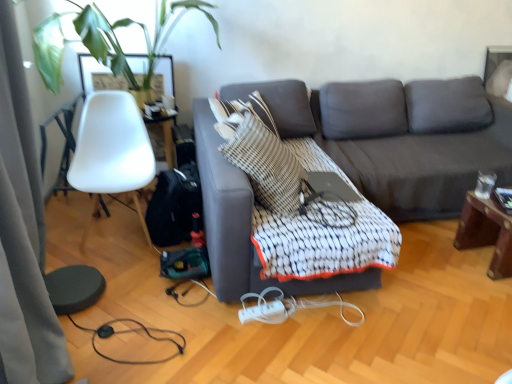
What do you see at coordinates (112, 149) in the screenshot?
I see `white matte chair at left` at bounding box center [112, 149].

What is the approximate width of white matte chair at left?

white matte chair at left is 21.68 inches in width.

Where is `white plastic extension cord at lower center`? white plastic extension cord at lower center is located at coordinates (264, 312).

Measure the distance between point (x=77, y=23) and camera.

A distance of 2.38 meters exists between point (x=77, y=23) and camera.

Where is `striped fabric throw pillow at center`? The image size is (512, 384). striped fabric throw pillow at center is located at coordinates (265, 163).

Describe the element at coordinates (288, 307) in the screenshot. This screenshot has height=384, width=512. I see `white plastic cable at lower center, which is counted as the second cable, starting from the left` at that location.

Where is `mahogany wood side table at right`? Image resolution: width=512 pixels, height=384 pixels. mahogany wood side table at right is located at coordinates (487, 232).

Locate an element on the screen. The height and width of the screenshot is (384, 512). white matte chair at left is located at coordinates (112, 149).

Is silky gray curtain at left positioned with its back to white textured quilt at center?

That's not correct — silky gray curtain at left is not looking away from white textured quilt at center.

I want to click on curtain above the white textured quilt at center (from the image's perspective), so click(x=23, y=232).

Does silky gray curtain at left appear on the left side of white textured quilt at center?

Indeed, silky gray curtain at left is positioned on the left side of white textured quilt at center.

Is dark gray fabric couch at center turned away from silky gray curtain at left?

No, silky gray curtain at left is not at the back of dark gray fabric couch at center.

Are dark gray fabric couch at center and silky gray curtain at left making contact?

No, dark gray fabric couch at center is not next to silky gray curtain at left.

Considering the sizes of objects dark gray fabric couch at center and silky gray curtain at left in the image provided, who is thinner, dark gray fabric couch at center or silky gray curtain at left?

silky gray curtain at left.

From the image's perspective, between silky gray curtain at left and striped fabric throw pillow at center, which one is located above?

From the image's view, striped fabric throw pillow at center is above.

Is silky gray curtain at left placed right next to striped fabric throw pillow at center?

There is a gap between silky gray curtain at left and striped fabric throw pillow at center.

Can you confirm if silky gray curtain at left is shorter than striped fabric throw pillow at center?

In fact, silky gray curtain at left may be taller than striped fabric throw pillow at center.

Is striped fabric throw pillow at center wider or thinner than black rubber cable at lower left, which appears as the 1th cable when viewed from the left?

In the image, striped fabric throw pillow at center appears to be more narrow than black rubber cable at lower left, which appears as the 1th cable when viewed from the left.

From their relative heights in the image, would you say striped fabric throw pillow at center is taller or shorter than black rubber cable at lower left, which appears as the 1th cable when viewed from the left?

Clearly, striped fabric throw pillow at center is taller compared to black rubber cable at lower left, which appears as the 1th cable when viewed from the left.

Do you think striped fabric throw pillow at center is within black rubber cable at lower left, which appears as the 1th cable when viewed from the left, or outside of it?

striped fabric throw pillow at center is not enclosed by black rubber cable at lower left, which appears as the 1th cable when viewed from the left.

From the image's perspective, is striped fabric throw pillow at center beneath black rubber cable at lower left, the 2th cable positioned from the right?

No, from the image's perspective, striped fabric throw pillow at center is not below black rubber cable at lower left, the 2th cable positioned from the right.

From a real-world perspective, is green leafy plant at upper left on silky gray curtain at left?

Yes, from a real-world perspective, green leafy plant at upper left is above silky gray curtain at left.

Is green leafy plant at upper left at the left side of silky gray curtain at left?

No, green leafy plant at upper left is not to the left of silky gray curtain at left.

In the scene shown: From the image's perspective, is green leafy plant at upper left positioned above or below silky gray curtain at left?

Based on their image positions, green leafy plant at upper left is located above silky gray curtain at left.

Is white plastic cable at lower center, positioned as the first cable in right-to-left order, inside the boundaries of black rubber cable at lower left, which appears as the 1th cable when viewed from the left, or outside?

The correct answer is: outside.

Which is more to the left, white plastic cable at lower center, which is counted as the second cable, starting from the left, or black rubber cable at lower left, which appears as the 1th cable when viewed from the left?

From the viewer's perspective, black rubber cable at lower left, which appears as the 1th cable when viewed from the left, appears more on the left side.

How distant is white plastic cable at lower center, which is counted as the second cable, starting from the left, from black rubber cable at lower left, which appears as the 1th cable when viewed from the left?

They are 19.93 inches apart.

At what (x,y) coordinates should I click in order to perform the action: click on cable that appears above the black rubber cable at lower left, the 2th cable positioned from the right (from the image's perspective). Please return your answer as a coordinate pair (x, y). Looking at the image, I should click on (288, 307).

Does black rubber cable at lower left, the 2th cable positioned from the right, have a lesser width compared to white textured quilt at center?

Correct, the width of black rubber cable at lower left, the 2th cable positioned from the right, is less than that of white textured quilt at center.

Locate an element on the screen. cable lying on the left of white textured quilt at center is located at coordinates (129, 332).

Is black rubber cable at lower left, which appears as the 1th cable when viewed from the left, oriented away from white textured quilt at center?

No, black rubber cable at lower left, which appears as the 1th cable when viewed from the left,'s orientation is not away from white textured quilt at center.

From the image's perspective, would you say black rubber cable at lower left, the 2th cable positioned from the right, is positioned over white textured quilt at center?

Incorrect, from the image's perspective, black rubber cable at lower left, the 2th cable positioned from the right, is lower than white textured quilt at center.

I want to click on quilt that appears on the right of silky gray curtain at left, so click(x=322, y=233).

This screenshot has width=512, height=384. I want to click on studio couch behind the silky gray curtain at left, so click(395, 140).

Considering their positions, is white plastic cable at lower center, which is counted as the second cable, starting from the left, positioned further to mahogany wood side table at right than black rubber cable at lower left, which appears as the 1th cable when viewed from the left?

Based on the image, black rubber cable at lower left, which appears as the 1th cable when viewed from the left, appears to be further to mahogany wood side table at right.

Based on their spatial positions, is white matte chair at left or mahogany wood side table at right closer to silky gray curtain at left?

white matte chair at left lies closer to silky gray curtain at left than the other object.

Which object lies further to the anchor point green leafy plant at upper left, black rubber cable at lower left, the 2th cable positioned from the right, or silky gray curtain at left?

Based on the image, black rubber cable at lower left, the 2th cable positioned from the right, appears to be further to green leafy plant at upper left.

Looking at the image, which one is located further to white plastic cable at lower center, which is counted as the second cable, starting from the left, mahogany wood side table at right or white textured quilt at center?

mahogany wood side table at right.

Which object lies nearer to the anchor point striped fabric throw pillow at center, white textured quilt at center or dark gray fabric couch at center?

Based on the image, white textured quilt at center appears to be nearer to striped fabric throw pillow at center.

Estimate the real-world distances between objects in this image. Which object is further from white textured quilt at center, black rubber cable at lower left, which appears as the 1th cable when viewed from the left, or striped fabric throw pillow at center?

black rubber cable at lower left, which appears as the 1th cable when viewed from the left, is further to white textured quilt at center.

Looking at the image, which one is located further to green leafy plant at upper left, white plastic cable at lower center, which is counted as the second cable, starting from the left, or dark gray fabric couch at center?

The object further to green leafy plant at upper left is white plastic cable at lower center, which is counted as the second cable, starting from the left.

Which object lies further to the anchor point white plastic extension cord at lower center, silky gray curtain at left or green leafy plant at upper left?

The object further to white plastic extension cord at lower center is green leafy plant at upper left.

This screenshot has height=384, width=512. I want to click on quilt that lies between striped fabric throw pillow at center and black rubber cable at lower left, the 2th cable positioned from the right, from top to bottom, so click(x=322, y=233).

Identify the location of studio couch between silky gray curtain at left and mahogany wood side table at right. The width and height of the screenshot is (512, 384). (395, 140).

This screenshot has width=512, height=384. I want to click on cable between green leafy plant at upper left and black rubber cable at lower left, the 2th cable positioned from the right, vertically, so click(288, 307).

Find the location of `cable situated between black rubber cable at lower left, the 2th cable positioned from the right, and mahogany wood side table at right from left to right`. cable situated between black rubber cable at lower left, the 2th cable positioned from the right, and mahogany wood side table at right from left to right is located at coordinates (288, 307).